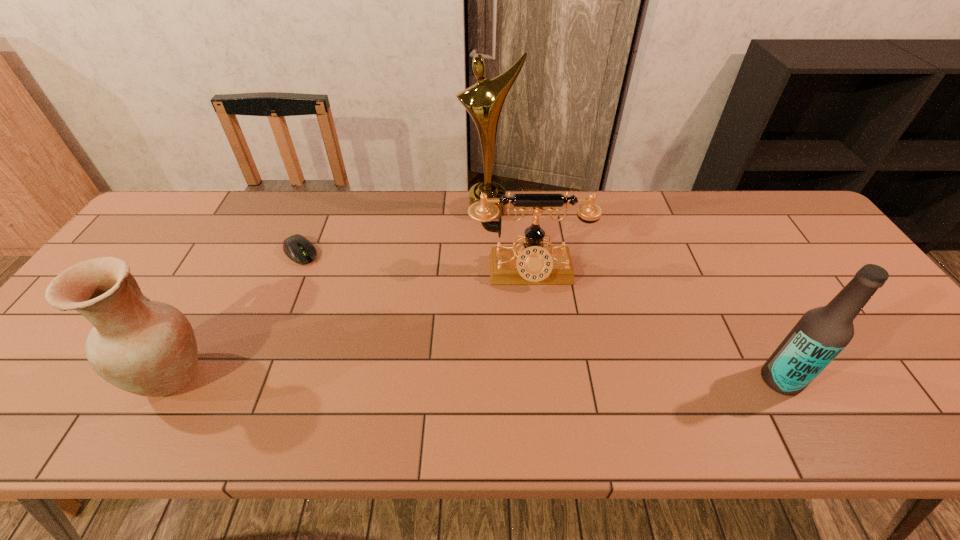
The image size is (960, 540). What are the coordinates of `object that is the third closest to the fourth tallest object` in the screenshot? It's located at (300, 250).

Locate an element on the screen. The width and height of the screenshot is (960, 540). blank area in the image that satisfies the following two spatial constraints: 1. on the back side of the farthest object; 2. on the left side of the leftmost object is located at coordinates (265, 210).

I want to click on vacant region that satisfies the following two spatial constraints: 1. on the back side of the shortest object; 2. on the right side of the leftmost object, so click(x=242, y=252).

Where is `free space that satisfies the following two spatial constraints: 1. on the back side of the fourth object from right to left; 2. on the right side of the pottery`? The height and width of the screenshot is (540, 960). free space that satisfies the following two spatial constraints: 1. on the back side of the fourth object from right to left; 2. on the right side of the pottery is located at coordinates (242, 252).

The width and height of the screenshot is (960, 540). What are the coordinates of `blank area in the image that satisfies the following two spatial constraints: 1. on the front side of the farthest object; 2. on the side of the rightmost object with the label` in the screenshot? It's located at tap(492, 380).

Identify the location of vacant region that satisfies the following two spatial constraints: 1. on the front side of the telephone; 2. on the right side of the tallest object. The height and width of the screenshot is (540, 960). (490, 273).

You are a GUI agent. You are given a task and a screenshot of the screen. Output one action in this format:
    pyautogui.click(x=<x>, y=<y>)
    Task: Click on the blank space that satisfies the following two spatial constraints: 1. on the front side of the tallest object; 2. on the left side of the telephone
    
    Given the screenshot: What is the action you would take?
    pyautogui.click(x=490, y=273)